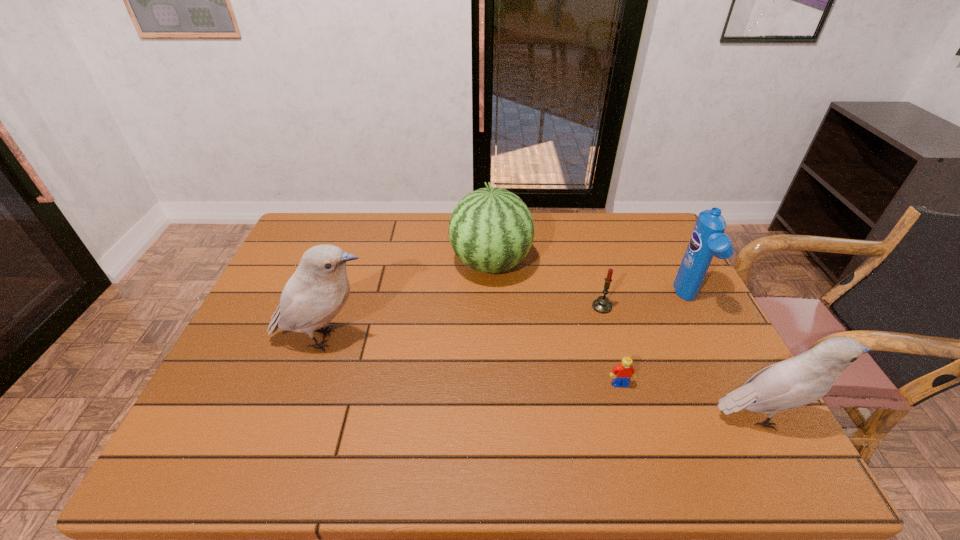
Identify the location of empty location between the shortest object and the candle. This screenshot has width=960, height=540. (611, 345).

Locate an element on the screen. The height and width of the screenshot is (540, 960). free space between the left bird and the shampoo is located at coordinates (507, 320).

At what (x,y) coordinates should I click in order to perform the action: click on vacant point located between the candle and the second nearest object. Please return your answer as a coordinate pair (x, y). The width and height of the screenshot is (960, 540). Looking at the image, I should click on (611, 345).

Identify the location of free point between the shorter bird and the watermelon. (628, 340).

You are a GUI agent. You are given a task and a screenshot of the screen. Output one action in this format:
    pyautogui.click(x=<x>, y=<y>)
    Task: Click on the free point between the candle and the watermelon
    This screenshot has width=960, height=540.
    Given the screenshot: What is the action you would take?
    pyautogui.click(x=546, y=285)

Locate an element on the screen. Image resolution: width=960 pixels, height=540 pixels. free spot between the second nearest object and the left bird is located at coordinates tap(472, 362).

In order to click on object identified as the second closest to the nearest object in this screenshot , I will do `click(707, 240)`.

Locate which object is the fifth closest to the nearer bird. Please provide its 2D coordinates. Your answer should be formatted as a tuple, i.e. [(x, y)], where the tuple contains the x and y coordinates of a point satisfying the conditions above.

[(313, 296)]